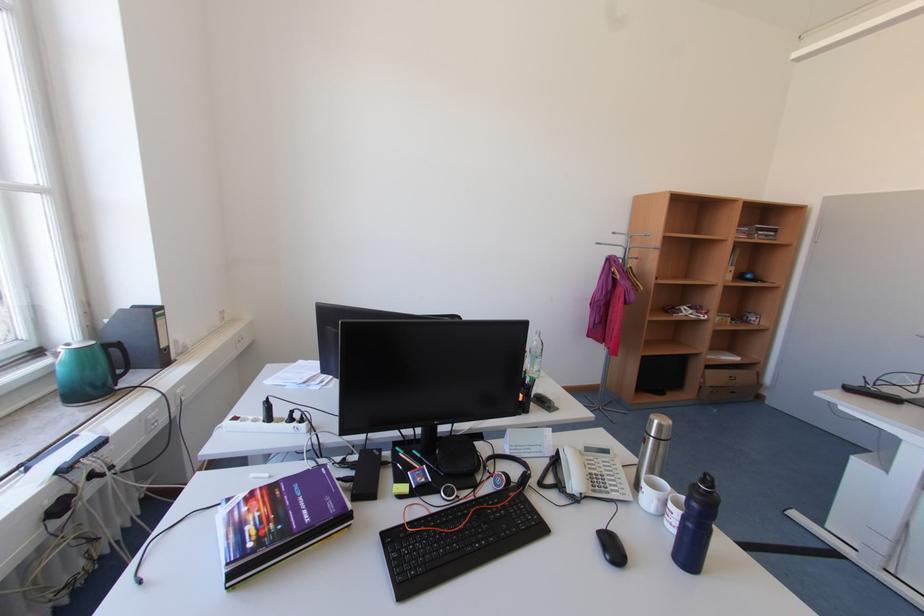
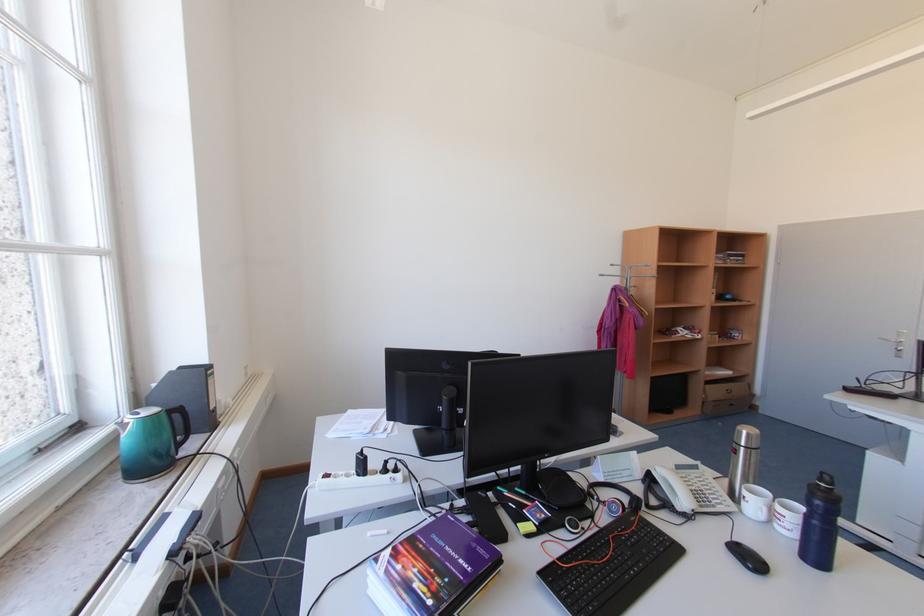
The point at (x=122, y=352) is marked in the first image. Where is the corresponding point in the second image?

(185, 416)